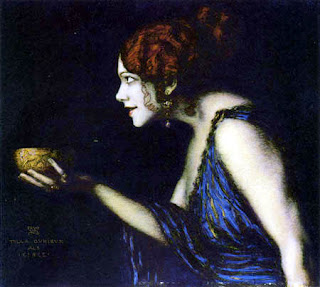
Where is `painting`? The image size is (320, 287). painting is located at coordinates (199, 176).